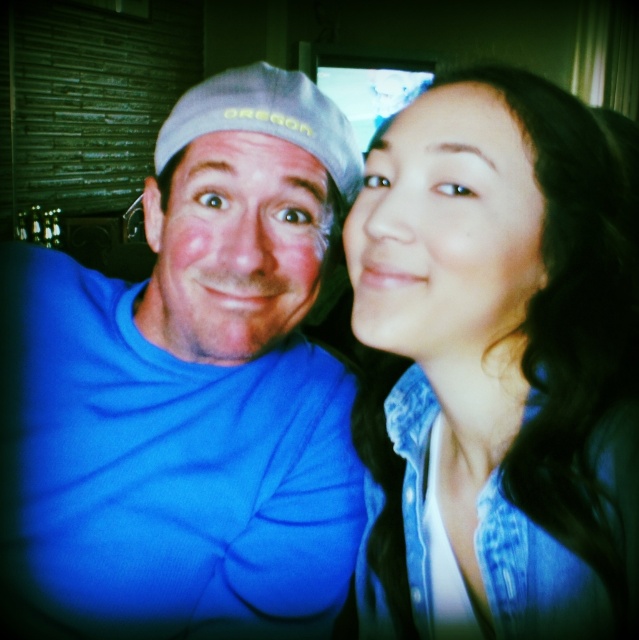
Question: Among these points, which one is nearest to the camera?

Choices:
 (A) (174, 296)
 (B) (203, 292)
 (C) (390, 332)

Answer: (C)

Question: Which point is closer to the camera?

Choices:
 (A) (288, 481)
 (B) (242, 77)
 (C) (562, 488)
 (D) (479, 211)

Answer: (D)

Question: Which object is positioned closest to the gray fabric cap at upper left?

Choices:
 (A) blue fabric shirt at center
 (B) smooth skin face at center

Answer: (B)

Question: Can you confirm if denim shirt at right is positioned below smooth skin face at center?

Choices:
 (A) yes
 (B) no

Answer: (A)

Question: Does denim shirt at right appear on the left side of gray fabric cap at upper left?

Choices:
 (A) yes
 (B) no

Answer: (B)

Question: Does blue fabric shirt at center have a larger size compared to matte blue shirt at left?

Choices:
 (A) no
 (B) yes

Answer: (B)